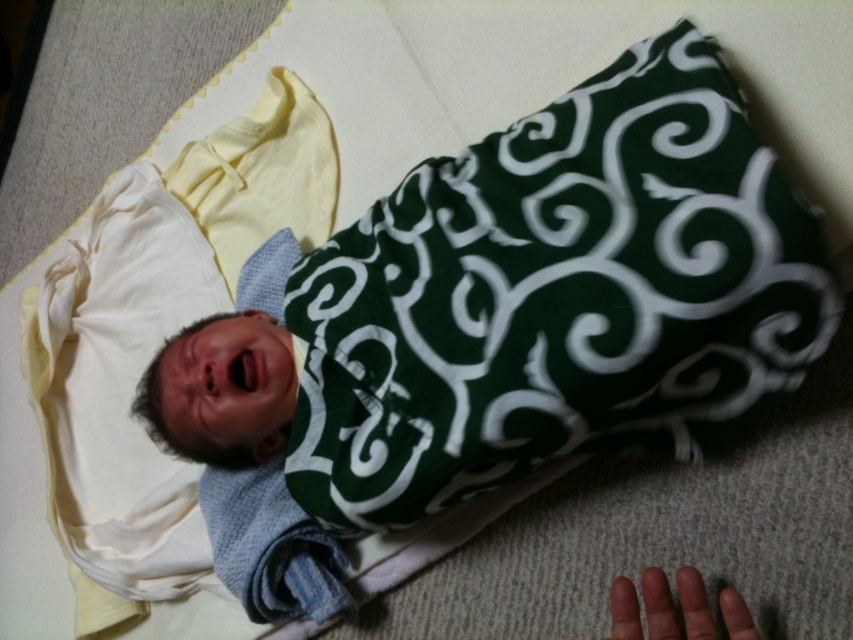
You are a photographer setting up a photo shoot for a baby. You have a green fabric pillow at center and a smooth skin hand at lower right in your frame. To ensure the baby stays comfortable, you need to know which object is bigger. Which one is larger?

The green fabric pillow at center is larger in size than the smooth skin hand at lower right.

You are a photographer setting up a shoot for a baby photo session. You want to place a small prop at the exact location where the green fabric pillow at center is currently positioned. According to the scene description, where should you place the prop in terms of coordinates?

The green fabric pillow at center is located at coordinates point (556, 296), so you should place the prop at that exact point.